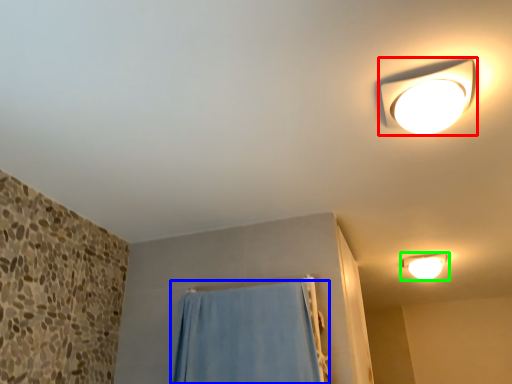
Question: Which object is the closest to the lamp (highlighted by a red box)? Choose among these: curtain (highlighted by a blue box) or lamp (highlighted by a green box).

Choices:
 (A) curtain
 (B) lamp

Answer: (A)